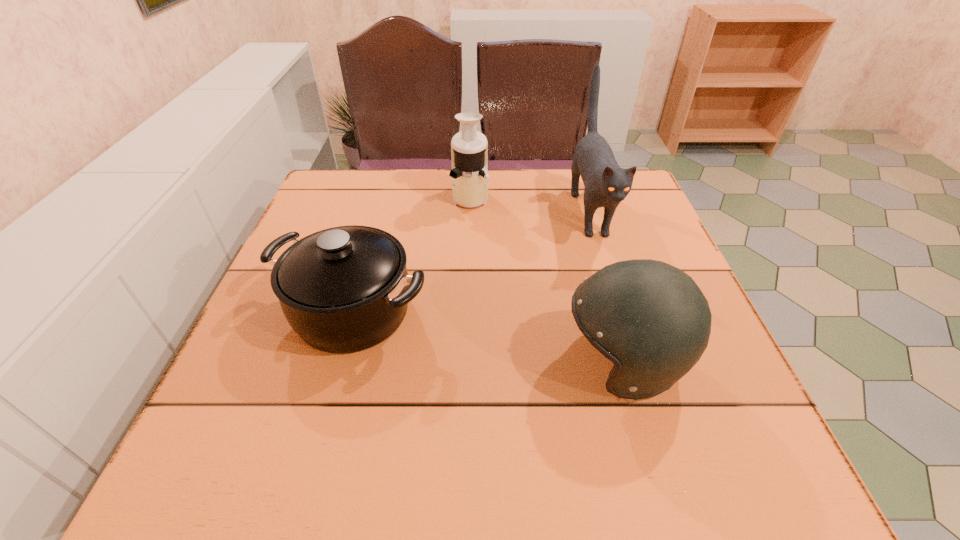
The height and width of the screenshot is (540, 960). In order to click on the tallest object in this screenshot , I will do `click(606, 184)`.

Locate an element on the screen. This screenshot has width=960, height=540. juicer is located at coordinates (469, 148).

Image resolution: width=960 pixels, height=540 pixels. What are the coordinates of `football helmet` in the screenshot? It's located at (651, 319).

Locate an element on the screen. the shortest object is located at coordinates (345, 289).

You are a GUI agent. You are given a task and a screenshot of the screen. Output one action in this format:
    pyautogui.click(x=<x>, y=<y>)
    Task: Click on the saucepan
    The height and width of the screenshot is (540, 960).
    Given the screenshot: What is the action you would take?
    pyautogui.click(x=345, y=289)

This screenshot has height=540, width=960. I want to click on vacant space situated 0.250m at the face of the cat, so click(633, 347).

The image size is (960, 540). I want to click on vacant space located 0.160m on the front of the second object from left to right, so click(x=468, y=252).

This screenshot has height=540, width=960. I want to click on free space located at the face opening of the football helmet, so click(528, 362).

This screenshot has width=960, height=540. Identify the location of vacant space located 0.370m at the face opening of the football helmet. (357, 362).

You are a GUI agent. You are given a task and a screenshot of the screen. Output one action in this format:
    pyautogui.click(x=<x>, y=<y>)
    Task: Click on the vacant space located 0.220m at the face opening of the football helmet
    
    Given the screenshot: What is the action you would take?
    pyautogui.click(x=440, y=362)